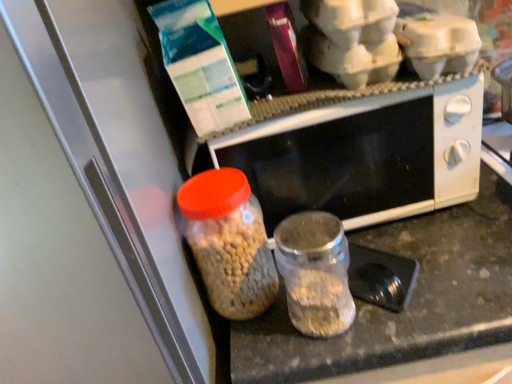
Question: Can you confirm if black matte microwave at center is shorter than transparent glass jar at center, which is counted as the second bottle, starting from the left?

Choices:
 (A) no
 (B) yes

Answer: (A)

Question: Is black matte microwave at center positioned before transparent glass jar at center, acting as the first bottle starting from the right?

Choices:
 (A) yes
 (B) no

Answer: (B)

Question: From a real-world perspective, is black matte microwave at center located higher than transparent glass jar at center, which is counted as the second bottle, starting from the left?

Choices:
 (A) yes
 (B) no

Answer: (A)

Question: From the image's perspective, is black matte microwave at center on top of transparent glass jar at center, which is counted as the second bottle, starting from the left?

Choices:
 (A) yes
 (B) no

Answer: (A)

Question: Does black matte microwave at center turn towards transparent glass jar at center, acting as the first bottle starting from the right?

Choices:
 (A) no
 (B) yes

Answer: (B)

Question: From their relative heights in the image, would you say black matte microwave at center is taller or shorter than translucent glass jar at center, the second bottle from the right?

Choices:
 (A) short
 (B) tall

Answer: (B)

Question: From a real-world perspective, is black matte microwave at center above or below translucent glass jar at center, which ranks as the 1th bottle in left-to-right order?

Choices:
 (A) below
 (B) above

Answer: (B)

Question: Considering the positions of point (315, 107) and point (267, 258), is point (315, 107) closer or farther from the camera than point (267, 258)?

Choices:
 (A) closer
 (B) farther

Answer: (B)

Question: Considering their positions, is black matte microwave at center located in front of or behind translucent glass jar at center, which ranks as the 1th bottle in left-to-right order?

Choices:
 (A) front
 (B) behind

Answer: (B)

Question: In terms of width, does transparent glass jar at center, which is counted as the second bottle, starting from the left, look wider or thinner when compared to black matte microwave at center?

Choices:
 (A) thin
 (B) wide

Answer: (A)

Question: Based on their sizes in the image, would you say transparent glass jar at center, acting as the first bottle starting from the right, is bigger or smaller than black matte microwave at center?

Choices:
 (A) small
 (B) big

Answer: (A)

Question: Is transparent glass jar at center, which is counted as the second bottle, starting from the left, inside or outside of black matte microwave at center?

Choices:
 (A) inside
 (B) outside

Answer: (B)

Question: From a real-world perspective, is transparent glass jar at center, which is counted as the second bottle, starting from the left, physically located above or below black matte microwave at center?

Choices:
 (A) above
 (B) below

Answer: (B)

Question: Considering the positions of translucent glass jar at center, the second bottle from the right, and black matte microwave at center in the image, is translucent glass jar at center, the second bottle from the right, bigger or smaller than black matte microwave at center?

Choices:
 (A) small
 (B) big

Answer: (A)

Question: From their relative heights in the image, would you say translucent glass jar at center, the second bottle from the right, is taller or shorter than black matte microwave at center?

Choices:
 (A) tall
 (B) short

Answer: (B)